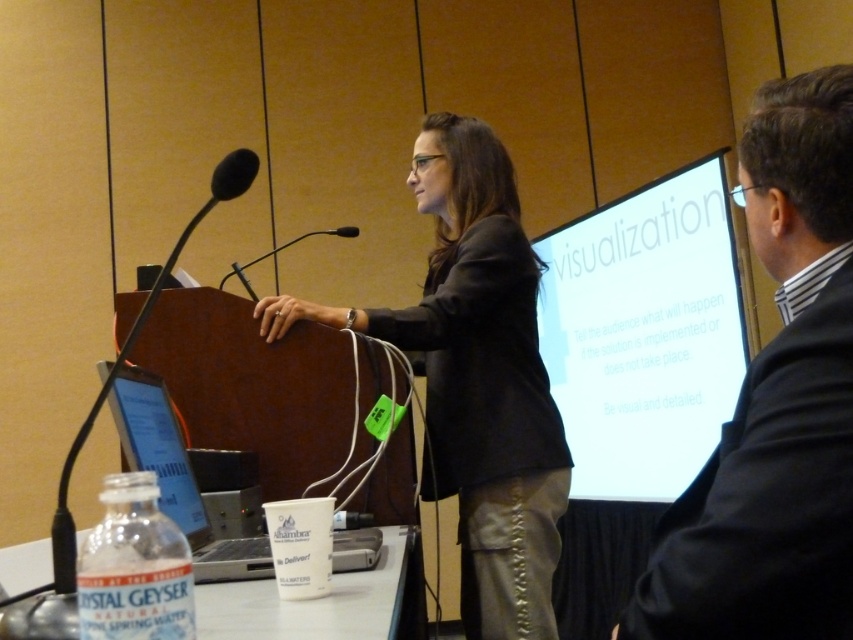
You are standing in the room and see two points marked in the image. Which point, point (782, 301) or point (339, 228), is closer to you?

Point (782, 301) is closer to the viewer than point (339, 228).

Consider the image. You are an attendee at the conference and want to ask a question. You need to approach the dark gray blazer at center and the black matte microphone at center. Which object should you move towards first?

You should move towards the black matte microphone at center first because the dark gray blazer at center is positioned on the right side of it, meaning the microphone is closer to your current position.

The black matte microphone at center is represented by point [260,259]. Is the microphone closer to the top or bottom of the image?

The black matte microphone at center is represented by point [260,259]. Since the y coordinate is 0.307, which is closer to the bottom of the image, the microphone is closer to the bottom.